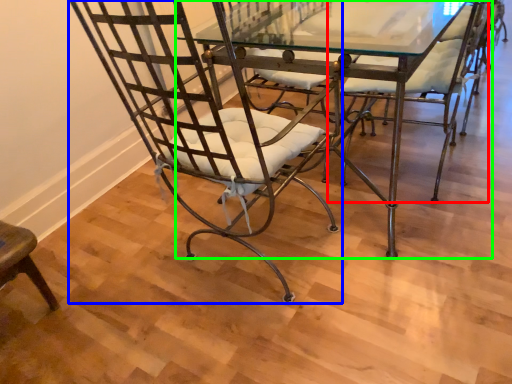
Question: Considering the real-world distances, which object is farthest from chair (highlighted by a red box)? chair (highlighted by a blue box) or table (highlighted by a green box)?

Choices:
 (A) chair
 (B) table

Answer: (A)